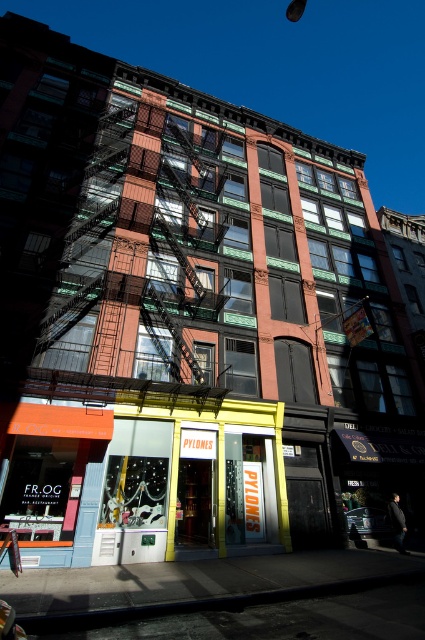
Question: From the image, what is the correct spatial relationship of yellow painted storefront at center in relation to rustic metal fire escape at center?

Choices:
 (A) below
 (B) above

Answer: (A)

Question: Can you confirm if yellow painted storefront at center is bigger than rustic metal fire escape at center?

Choices:
 (A) yes
 (B) no

Answer: (B)

Question: Among these points, which one is farthest from the camera?

Choices:
 (A) (65, 557)
 (B) (266, 444)
 (C) (149, 276)

Answer: (C)

Question: Is yellow painted storefront at center above orange matte signboard at lower left?

Choices:
 (A) no
 (B) yes

Answer: (B)

Question: Which object is the closest to the yellow painted storefront at center?

Choices:
 (A) rustic metal fire escape at center
 (B) orange matte signboard at lower left

Answer: (B)

Question: Among these objects, which one is farthest from the camera?

Choices:
 (A) yellow painted storefront at center
 (B) rustic metal fire escape at center

Answer: (A)